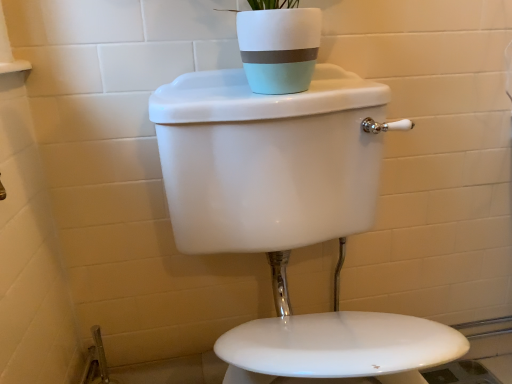
What do you see at coordinates (288, 214) in the screenshot? I see `white glossy toilet at center` at bounding box center [288, 214].

Where is `white glossy toilet at center`? This screenshot has height=384, width=512. white glossy toilet at center is located at coordinates (288, 214).

The image size is (512, 384). In order to click on white glossy toilet at center in this screenshot , I will do click(x=288, y=214).